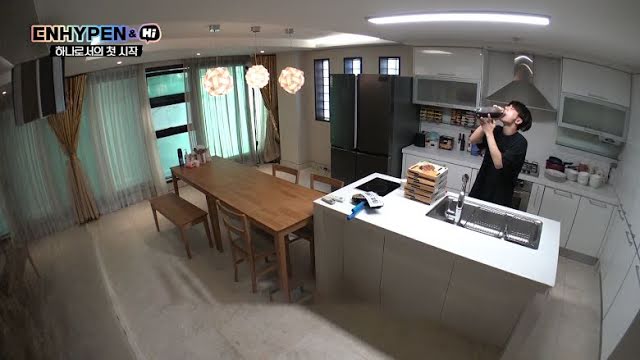
The image size is (640, 360). I want to click on floor, so click(285, 323).